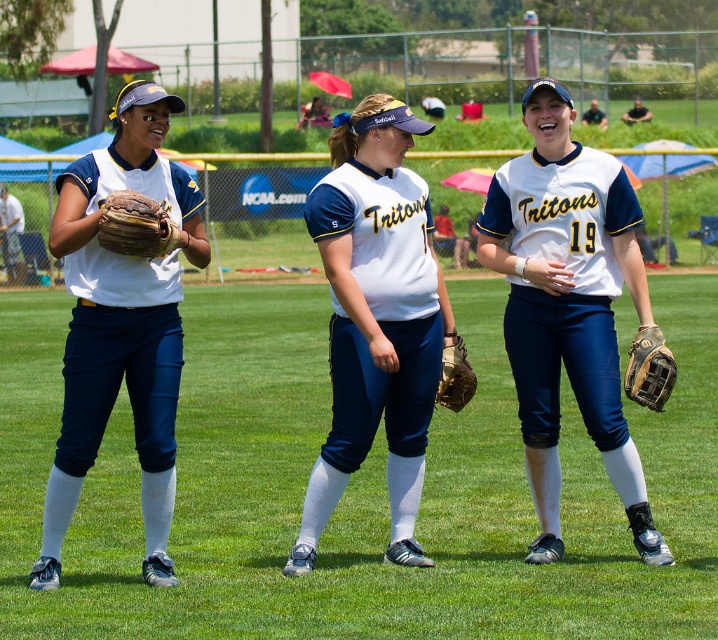
Question: Can you confirm if white matte jersey at left is positioned below brown leather glove at center?

Choices:
 (A) no
 (B) yes

Answer: (A)

Question: Does white matte jersey at left have a greater width compared to brown leather baseball glove at lower right?

Choices:
 (A) no
 (B) yes

Answer: (B)

Question: Which of the following is the closest to the observer?

Choices:
 (A) white matte uniform at center
 (B) brown leather glove at center

Answer: (A)

Question: Which point appears closest to the camera in this image?

Choices:
 (A) (668, 349)
 (B) (327, 499)
 (C) (449, 362)

Answer: (B)

Question: Can you confirm if white matte uniform at center is thinner than brown leather glove at left?

Choices:
 (A) yes
 (B) no

Answer: (B)

Question: Which of the following is the farthest from the observer?

Choices:
 (A) white matte jersey at left
 (B) brown leather glove at center
 (C) white matte uniform at center

Answer: (B)